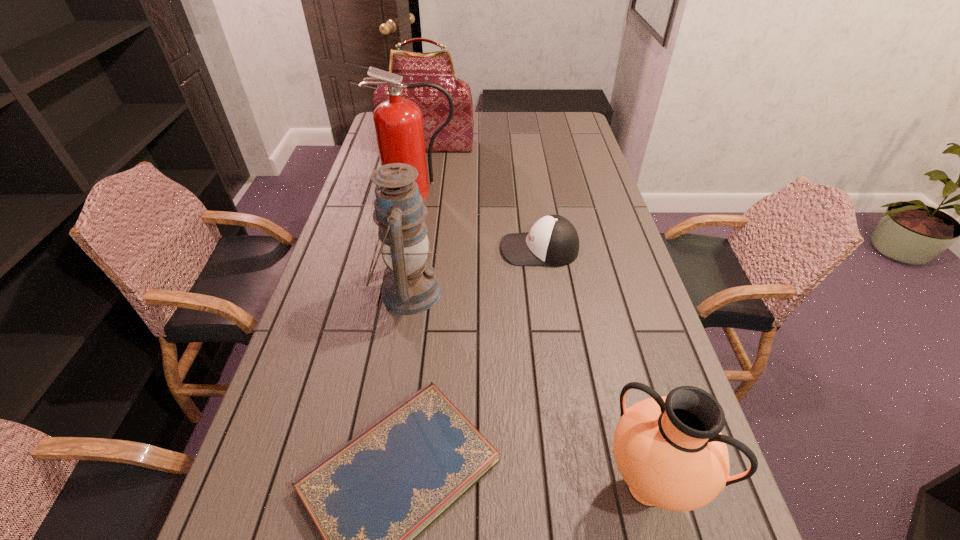
Image resolution: width=960 pixels, height=540 pixels. I want to click on fire extinguisher, so coord(398,122).

What are the coordinates of `the farthest object` in the screenshot? It's located at pos(437,67).

This screenshot has width=960, height=540. I want to click on oil lamp, so click(x=410, y=285).

I want to click on cap, so click(x=553, y=241).

This screenshot has width=960, height=540. Identify the location of free space located with the handle and nozzle on the second farthest object. (407, 251).

Locate an element on the screen. This screenshot has height=540, width=960. vacant area located on the front-facing side of the handbag is located at coordinates (418, 200).

Locate an element on the screen. The image size is (960, 540). vacant space located on the right of the oil lamp is located at coordinates (473, 292).

At what (x,y) coordinates should I click in order to perform the action: click on free region located 0.330m on the front panel of the cap. Please return your answer as a coordinate pair (x, y). The height and width of the screenshot is (540, 960). Looking at the image, I should click on (395, 249).

Find the location of a particular element. The image size is (960, 540). free region located 0.250m on the front panel of the cap is located at coordinates (420, 249).

Image resolution: width=960 pixels, height=540 pixels. In order to click on vacant space situated on the front panel of the cap in this screenshot , I will do `click(475, 249)`.